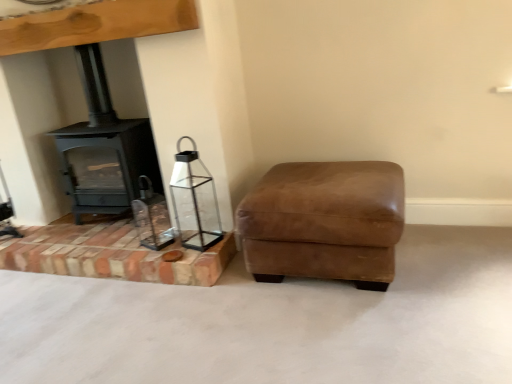
Question: Do you think suede brown ottoman at lower right is within matte black wood burning stove at left, or outside of it?

Choices:
 (A) outside
 (B) inside

Answer: (A)

Question: Is suede brown ottoman at lower right taller or shorter than matte black wood burning stove at left?

Choices:
 (A) short
 (B) tall

Answer: (A)

Question: Which object is the closest to the clear glass lantern at lower left?

Choices:
 (A) matte black wood burning stove at left
 (B) suede brown ottoman at lower right

Answer: (A)

Question: Based on their relative distances, which object is farther from the suede brown ottoman at lower right?

Choices:
 (A) clear glass lantern at lower left
 (B) matte black wood burning stove at left

Answer: (B)